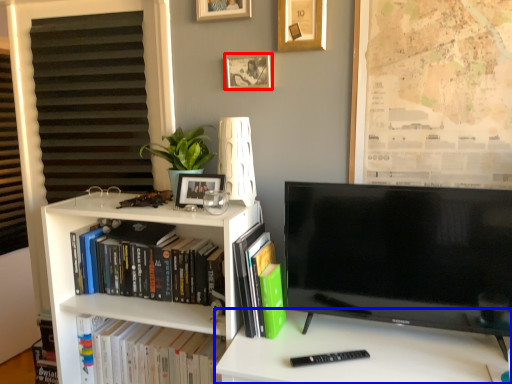
Question: Which object is further to the camera taking this photo, picture frame (highlighted by a red box) or desk (highlighted by a blue box)?

Choices:
 (A) picture frame
 (B) desk

Answer: (A)